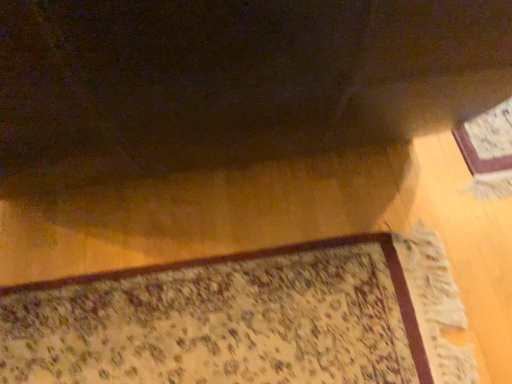
What do you see at coordinates (223, 321) in the screenshot?
I see `patterned carpet at lower center` at bounding box center [223, 321].

Locate an element on the screen. The height and width of the screenshot is (384, 512). patterned carpet at lower center is located at coordinates tap(223, 321).

You are a GUI agent. You are given a task and a screenshot of the screen. Output one action in this format:
    pyautogui.click(x=<x>, y=<y>)
    Task: Click on the patterned carpet at lower center
    The image size is (512, 384).
    Given the screenshot: What is the action you would take?
    pyautogui.click(x=223, y=321)